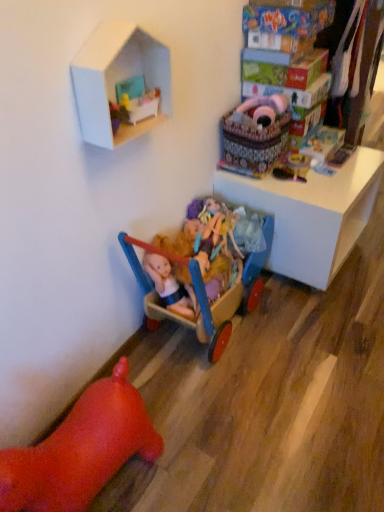
Locate an element on the screen. vacant area that is in front of white glossy table at upper right is located at coordinates (318, 329).